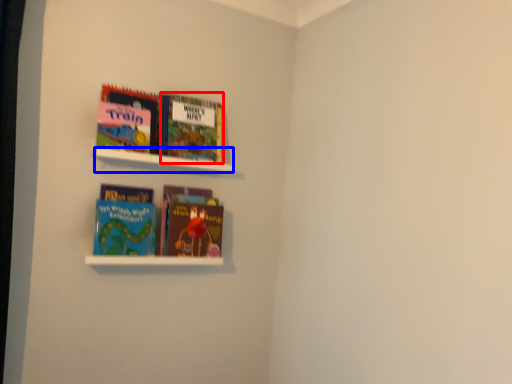
Question: Which of the following is the closest to the observer, book (highlighted by a red box) or cabinet (highlighted by a blue box)?

Choices:
 (A) book
 (B) cabinet

Answer: (B)